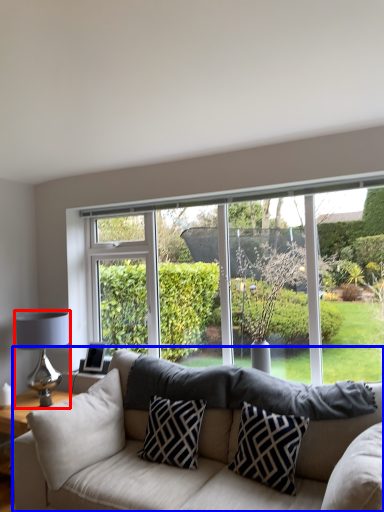
Question: Which object is closer to the camera taking this photo, table lamp (highlighted by a red box) or studio couch (highlighted by a blue box)?

Choices:
 (A) table lamp
 (B) studio couch

Answer: (B)